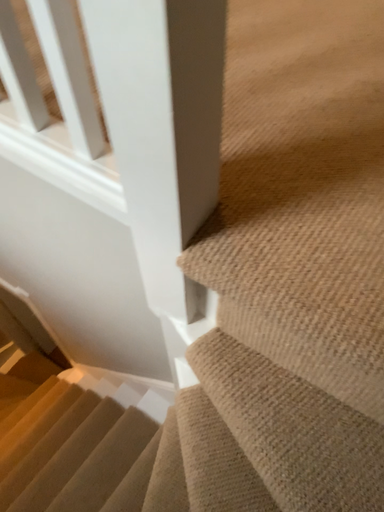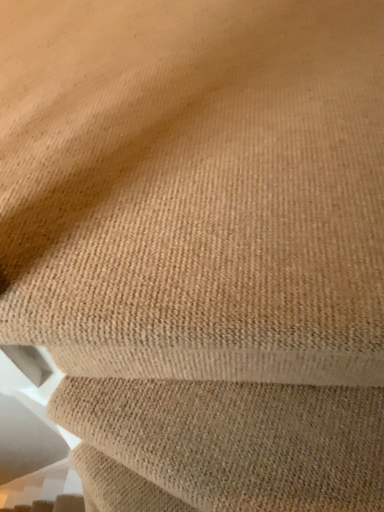
Question: Which way did the camera rotate in the video?

Choices:
 (A) rotated upward
 (B) rotated downward

Answer: (A)